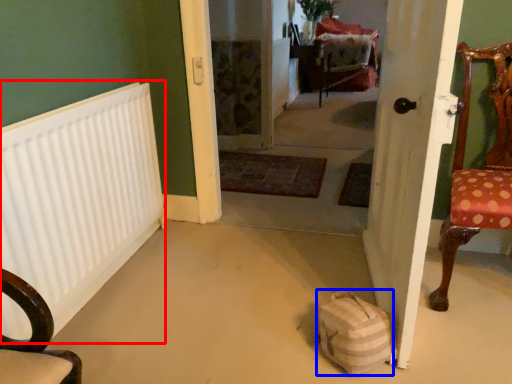
Question: Which object is closer to the camera taking this photo, radiator (highlighted by a red box) or bag (highlighted by a blue box)?

Choices:
 (A) radiator
 (B) bag

Answer: (A)